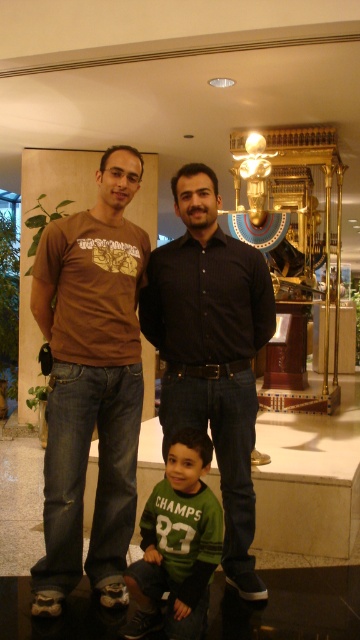
Is black matte shirt at center closer to the viewer compared to green jersey at center?

No, it is behind green jersey at center.

Can you confirm if black matte shirt at center is thinner than green jersey at center?

No, black matte shirt at center is not thinner than green jersey at center.

Does point (190, 369) come in front of point (159, 532)?

No, (190, 369) is further to viewer.

Locate an element on the screen. The image size is (360, 640). black matte shirt at center is located at coordinates (212, 349).

Is brown cotton t-shirt at center thinner than black matte shirt at center?

Yes, brown cotton t-shirt at center is thinner than black matte shirt at center.

Is point (133, 186) positioned in front of point (146, 332)?

Yes.

Find the location of a particular element. brown cotton t-shirt at center is located at coordinates (91, 384).

Is brown cotton t-shirt at center further to the viewer compared to green jersey at center?

Yes, brown cotton t-shirt at center is further from the viewer.

Between brown cotton t-shirt at center and green jersey at center, which one has more height?

brown cotton t-shirt at center is taller.

Identify the location of brown cotton t-shirt at center. (91, 384).